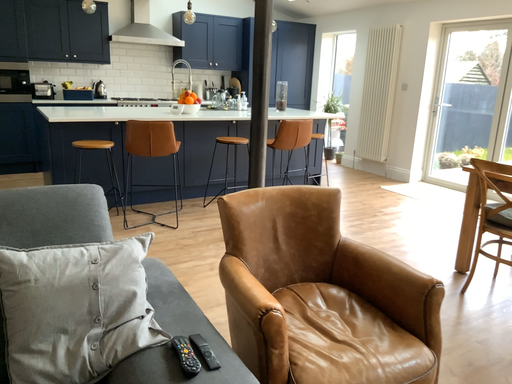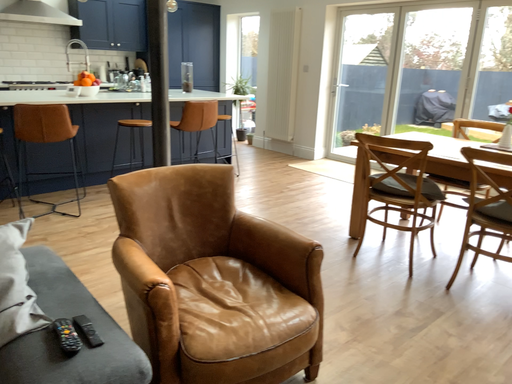
Question: Which way did the camera rotate in the video?

Choices:
 (A) rotated right
 (B) rotated left

Answer: (A)